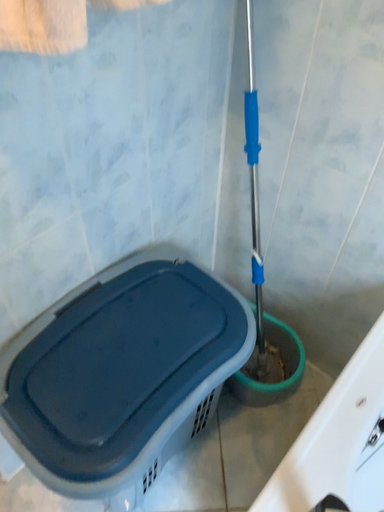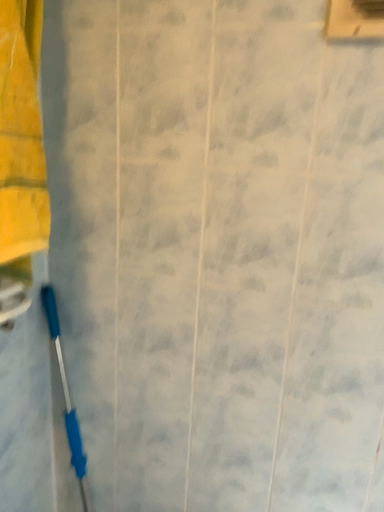
Question: How did the camera likely rotate when shooting the video?

Choices:
 (A) rotated upward
 (B) rotated downward

Answer: (A)